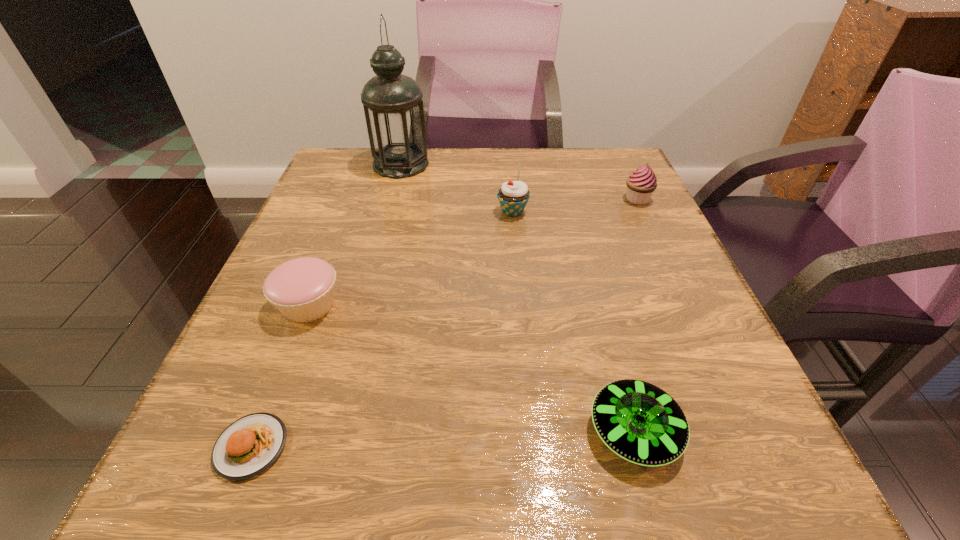
Where is `the farthest object`? The height and width of the screenshot is (540, 960). the farthest object is located at coordinates (393, 106).

Where is `the tallest object`? Image resolution: width=960 pixels, height=540 pixels. the tallest object is located at coordinates (393, 106).

Identify the location of the second cupcake from right to left. (513, 196).

Where is `the rightmost object`? This screenshot has width=960, height=540. the rightmost object is located at coordinates (642, 183).

The height and width of the screenshot is (540, 960). In order to click on the fourth farthest object in this screenshot , I will do `click(302, 289)`.

I want to click on the shortest cupcake, so click(302, 289).

You are a GUI agent. You are given a task and a screenshot of the screen. Output one action in this format:
    pyautogui.click(x=<x>, y=<y>)
    Task: Click on the saucer
    The height and width of the screenshot is (540, 960).
    Given the screenshot: What is the action you would take?
    pyautogui.click(x=640, y=422)

Image resolution: width=960 pixels, height=540 pixels. Find the location of `the fifth tallest object`. the fifth tallest object is located at coordinates (640, 422).

What are the coordinates of `food` in the screenshot? It's located at (248, 446).

Where is `vacant space located 0.070m on the left of the farthest object`? The image size is (960, 540). vacant space located 0.070m on the left of the farthest object is located at coordinates (346, 164).